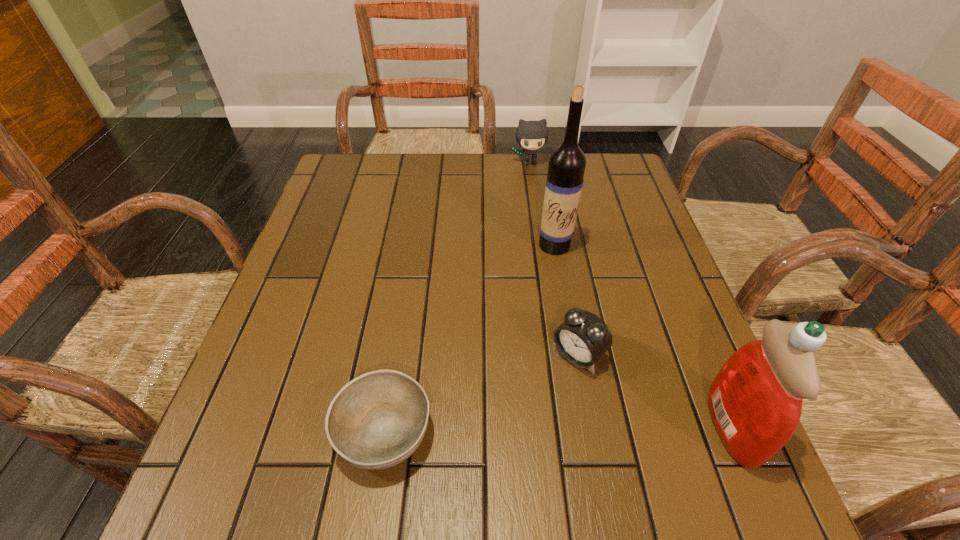
You are a GUI agent. You are given a task and a screenshot of the screen. Output one action in this format:
    pyautogui.click(x=<x>, y=<y>)
    Task: Click on the vacant space situated on the back of the bowl
    This screenshot has height=540, width=960.
    Given the screenshot: What is the action you would take?
    pyautogui.click(x=413, y=245)

Where is `blank space located on the label of the fourth nearest object`? blank space located on the label of the fourth nearest object is located at coordinates (535, 325).

At what (x,y) coordinates should I click in order to perform the action: click on vacant space situated 0.270m on the label of the fourth nearest object. Please return your answer as a coordinate pair (x, y). The image size is (960, 540). Looking at the image, I should click on (531, 344).

The height and width of the screenshot is (540, 960). I want to click on free space located on the label of the fourth nearest object, so click(x=547, y=273).

Find the location of a particular element. vacant area located 0.280m on the front-facing side of the farthest object is located at coordinates (545, 228).

I want to click on vacant region located on the front-facing side of the farthest object, so click(x=552, y=258).

Image resolution: width=960 pixels, height=540 pixels. I want to click on blank space located 0.270m on the front-facing side of the farthest object, so click(545, 226).

The image size is (960, 540). Identify the location of free space located 0.170m on the front side of the fourth tallest object. (504, 434).

I want to click on blank space located 0.110m on the front side of the fourth tallest object, so click(x=526, y=410).

Locate an element on the screen. This screenshot has width=960, height=540. free space located 0.200m on the front side of the fourth tallest object is located at coordinates (492, 447).